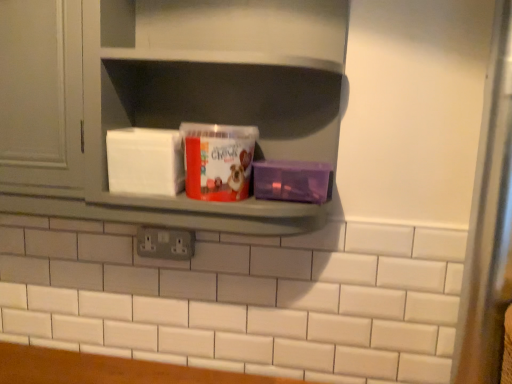
Question: From their relative heights in the image, would you say transparent glass door at right is taller or shorter than matte plastic tub at center?

Choices:
 (A) tall
 (B) short

Answer: (A)

Question: Is transparent glass door at right inside or outside of matte plastic tub at center?

Choices:
 (A) outside
 (B) inside

Answer: (A)

Question: Estimate the real-world distances between objects in this image. Which object is farther from the transparent glass door at right?

Choices:
 (A) matte gray shelf at center
 (B) matte plastic tub at center
 (C) purple plastic container at right
 (D) matte gray cabinet at upper left
 (E) gray plastic electric outlet at center

Answer: (D)

Question: Considering the real-world distances, which object is closest to the purple plastic container at right?

Choices:
 (A) matte gray cabinet at upper left
 (B) gray plastic electric outlet at center
 (C) transparent glass door at right
 (D) matte plastic tub at center
 (E) matte gray shelf at center

Answer: (D)